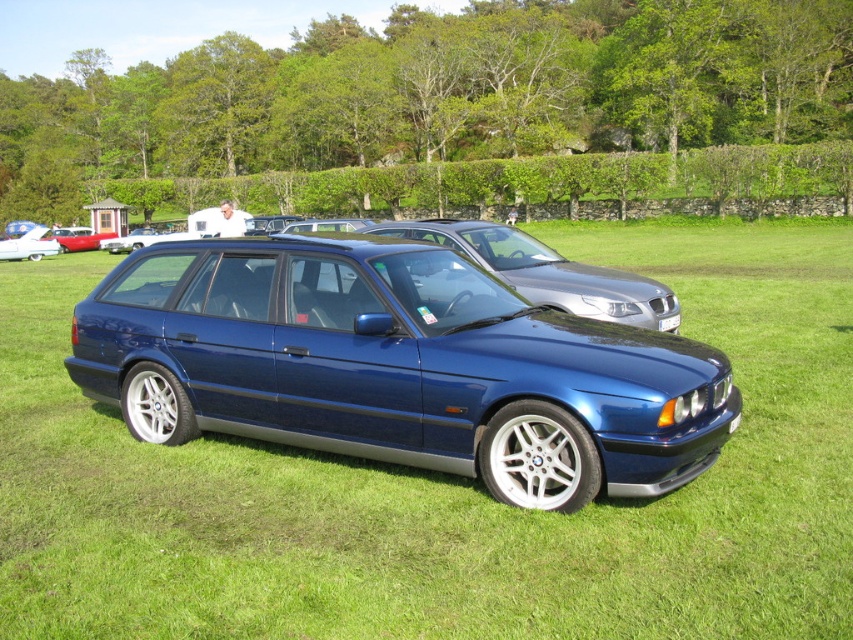
Does matte red car at center appear under white plastic license plate at center?

No, matte red car at center is not below white plastic license plate at center.

Which is behind, point (77, 240) or point (675, 321)?

The point (77, 240) is behind.

Where is `matte red car at center`? The width and height of the screenshot is (853, 640). matte red car at center is located at coordinates (78, 237).

How distant is white glossy car at left from matte red car at center?

white glossy car at left is 9.07 meters away from matte red car at center.

Is point (41, 241) positioned in front of point (64, 243)?

Yes.

Who is more forward, (15,241) or (102,237)?

Point (15,241) is more forward.

Locate an element on the screen. This screenshot has height=640, width=853. white glossy car at left is located at coordinates (28, 244).

Is point (30, 250) farther from viewer compared to point (100, 241)?

No, it is not.

Does white glossy car at left come in front of white glossy sedan at center?

That is False.

Is point (44, 252) farther from viewer compared to point (165, 234)?

No.

Identify the location of white glossy car at left. The width and height of the screenshot is (853, 640). (28, 244).